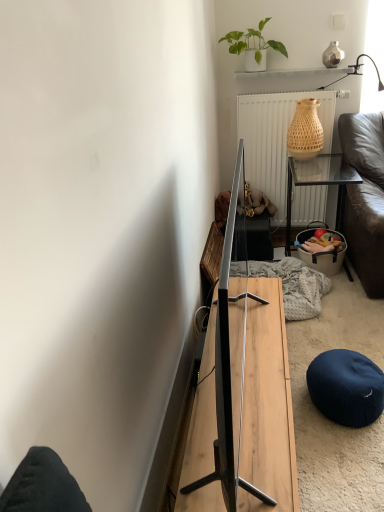
Question: In the image, is wooden table at right, arranged as the first table when viewed from the top, positioned in front of or behind white textured radiator at upper center?

Choices:
 (A) front
 (B) behind

Answer: (A)

Question: Is wooden table at right, which is counted as the 2th table, starting from the left, situated inside white textured radiator at upper center or outside?

Choices:
 (A) inside
 (B) outside

Answer: (B)

Question: Which of these objects is positioned farthest from the green matte plant at upper center?

Choices:
 (A) wooden table at right, the second table when ordered from front to back
 (B) light wood table at center, arranged as the second table when viewed from the right
 (C) dark blue fabric stool at lower right
 (D) white textured radiator at upper center

Answer: (C)

Question: Considering the real-world distances, which object is closest to the wooden table at right, which is the second table in bottom-to-top order?

Choices:
 (A) light wood table at center, positioned as the 2th table in back-to-front order
 (B) dark blue fabric stool at lower right
 (C) green matte plant at upper center
 (D) white textured radiator at upper center

Answer: (D)